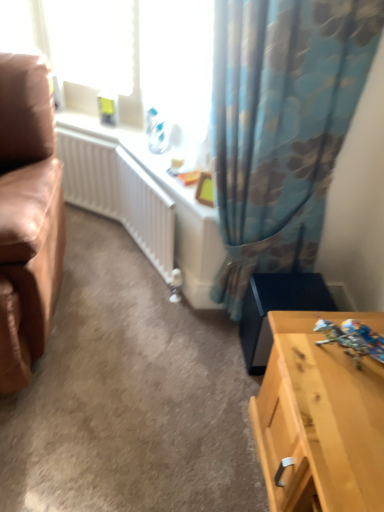
Locate an element on the screen. The height and width of the screenshot is (512, 384). free spot in front of shiny metallic robot at lower right is located at coordinates pos(345,393).